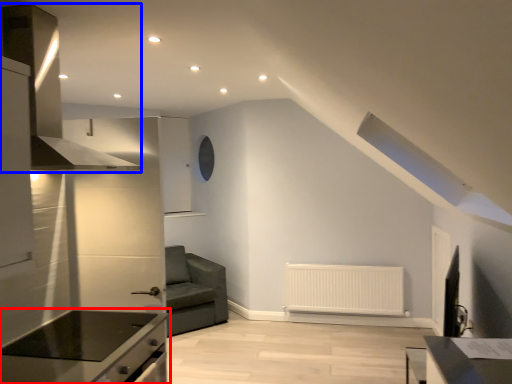
Question: Among these objects, which one is nearest to the camera, countertop (highlighted by a red box) or exhaust hood (highlighted by a blue box)?

Choices:
 (A) countertop
 (B) exhaust hood

Answer: (B)